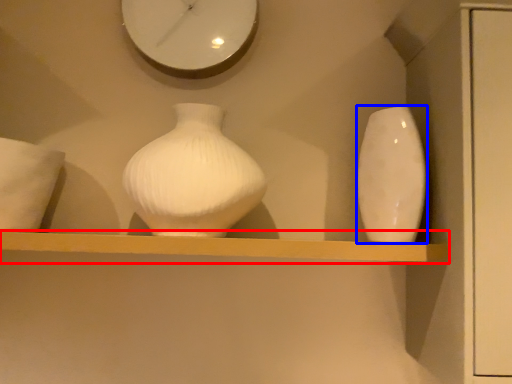
Question: Which object appears farthest to the camera in this image, shelf (highlighted by a red box) or vase (highlighted by a blue box)?

Choices:
 (A) shelf
 (B) vase

Answer: (B)